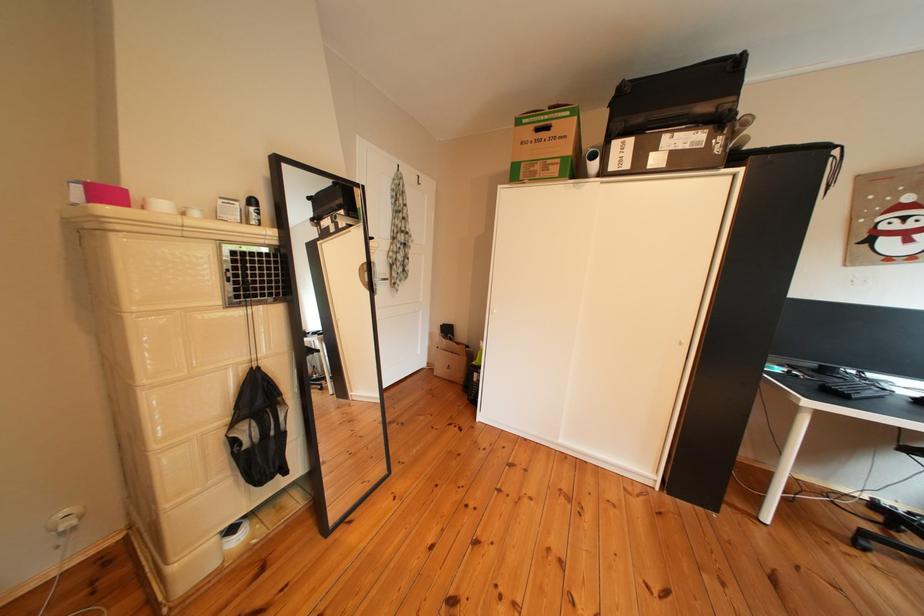
I want to click on black case handle, so click(x=711, y=118).